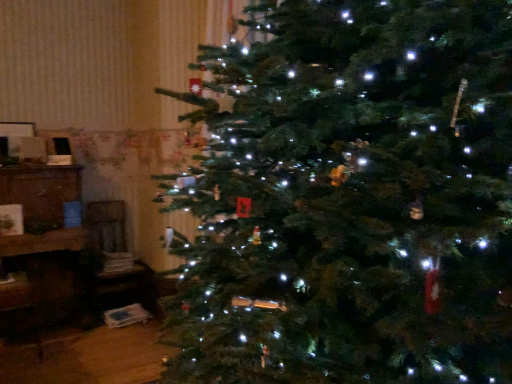
I want to click on green matte christmas tree at center, so click(x=351, y=197).

Locate an element on the screen. brown wooden cabinet at left is located at coordinates (41, 248).

Describe the element at coordinates (41, 248) in the screenshot. I see `brown wooden cabinet at left` at that location.

You are a GUI agent. You are given a task and a screenshot of the screen. Output one action in this format:
    pyautogui.click(x=<x>, y=<y>)
    Task: Click on the green matte christmas tree at center
    
    Given the screenshot: What is the action you would take?
    pyautogui.click(x=351, y=197)

Is wooden chair at left outside of brown wooden cabinet at left?

Yes, wooden chair at left is located beyond the bounds of brown wooden cabinet at left.

From the image's perspective, is wooden chair at left under brown wooden cabinet at left?

Yes, from the image's perspective, wooden chair at left is beneath brown wooden cabinet at left.

Does point (119, 264) appear closer or farther from the camera than point (4, 314)?

Point (119, 264) is farther from the camera than point (4, 314).

Is wooden chair at left taller or shorter than green matte christmas tree at center?

Considering their sizes, wooden chair at left has less height than green matte christmas tree at center.

Are wooden chair at left and green matte christmas tree at center making contact?

No.

Is wooden chair at left facing towards green matte christmas tree at center?

No, wooden chair at left is not oriented towards green matte christmas tree at center.

How different are the orientations of brown wooden cabinet at left and wooden chair at left in degrees?

The angle between the facing direction of brown wooden cabinet at left and the facing direction of wooden chair at left is 0.00023 degrees.

From the image's perspective, is brown wooden cabinet at left above or below wooden chair at left?

brown wooden cabinet at left is above wooden chair at left.

Where is `chair on the right of the brown wooden cabinet at left`? The height and width of the screenshot is (384, 512). chair on the right of the brown wooden cabinet at left is located at coordinates (118, 260).

Is brown wooden cabinet at left in contact with wooden chair at left?

No, brown wooden cabinet at left is not next to wooden chair at left.

Who is smaller, green matte christmas tree at center or wooden chair at left?

With smaller size is wooden chair at left.

Can you confirm if green matte christmas tree at center is taller than wooden chair at left?

Correct, green matte christmas tree at center is much taller as wooden chair at left.

The height and width of the screenshot is (384, 512). I want to click on christmas tree above the wooden chair at left (from a real-world perspective), so click(x=351, y=197).

Is green matte christmas tree at center not near wooden chair at left?

Yes.

Is there a large distance between green matte christmas tree at center and brown wooden cabinet at left?

Absolutely, green matte christmas tree at center is distant from brown wooden cabinet at left.

From the image's perspective, would you say green matte christmas tree at center is shown under brown wooden cabinet at left?

No.

Considering the positions of objects green matte christmas tree at center and brown wooden cabinet at left in the image provided, who is more to the left, green matte christmas tree at center or brown wooden cabinet at left?

brown wooden cabinet at left.

In the image, there is a green matte christmas tree at center. Where is `furniture below it (from the image's perspective)`? furniture below it (from the image's perspective) is located at coordinates (41, 248).

From a real-world perspective, is brown wooden cabinet at left physically below green matte christmas tree at center?

Indeed, from a real-world perspective, brown wooden cabinet at left is positioned beneath green matte christmas tree at center.

Which object is closer to the camera taking this photo, brown wooden cabinet at left or green matte christmas tree at center?

brown wooden cabinet at left is closer to the camera.

In the image, there is a brown wooden cabinet at left. Where is `chair below it (from a real-world perspective)`? chair below it (from a real-world perspective) is located at coordinates (118, 260).

Locate an element on the screen. The height and width of the screenshot is (384, 512). chair located on the left of green matte christmas tree at center is located at coordinates (118, 260).

When comparing their distances from green matte christmas tree at center, does wooden chair at left or brown wooden cabinet at left seem closer?

brown wooden cabinet at left lies closer to green matte christmas tree at center than the other object.

From the image, which object appears to be farther from green matte christmas tree at center, brown wooden cabinet at left or wooden chair at left?

Based on the image, wooden chair at left appears to be further to green matte christmas tree at center.

Based on their spatial positions, is green matte christmas tree at center or brown wooden cabinet at left closer to wooden chair at left?

brown wooden cabinet at left.

From the image, which object appears to be farther from brown wooden cabinet at left, green matte christmas tree at center or wooden chair at left?

Among the two, green matte christmas tree at center is located further to brown wooden cabinet at left.

Which object lies nearer to the anchor point brown wooden cabinet at left, wooden chair at left or green matte christmas tree at center?

Among the two, wooden chair at left is located nearer to brown wooden cabinet at left.

When comparing their distances from wooden chair at left, does brown wooden cabinet at left or green matte christmas tree at center seem closer?

Among the two, brown wooden cabinet at left is located nearer to wooden chair at left.

Locate an element on the screen. chair located between brown wooden cabinet at left and green matte christmas tree at center in the left-right direction is located at coordinates (118, 260).